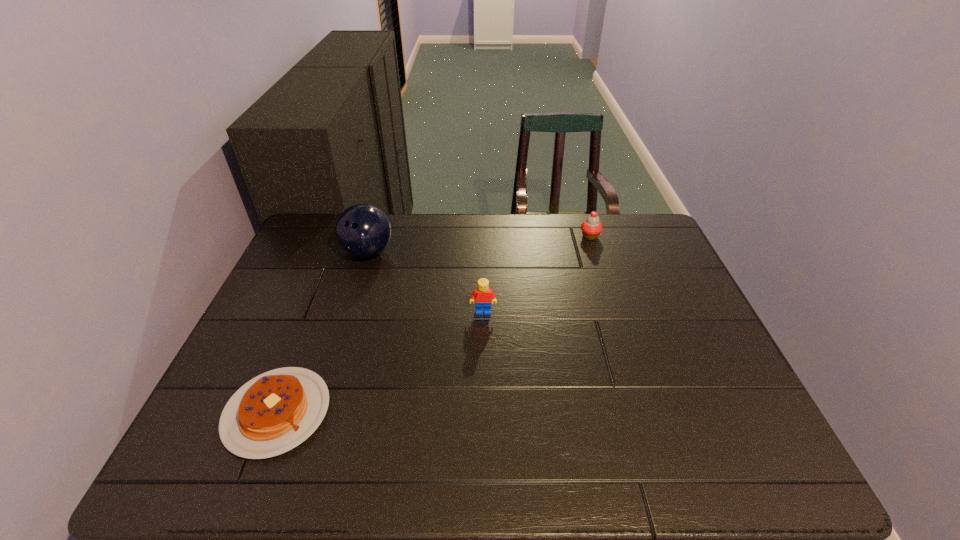
At what (x,y) coordinates should I click in order to perform the action: click on vacant space in between the third tallest object and the nearest object. Please return your answer as a coordinate pair (x, y). Looking at the image, I should click on (434, 325).

Locate an element on the screen. The height and width of the screenshot is (540, 960). unoccupied position between the second nearest object and the cupcake is located at coordinates (537, 274).

Select which object appears as the third closest to the tallest object. Please provide its 2D coordinates. Your answer should be formatted as a tuple, i.e. [(x, y)], where the tuple contains the x and y coordinates of a point satisfying the conditions above.

[(591, 228)]

You are a GUI agent. You are given a task and a screenshot of the screen. Output one action in this format:
    pyautogui.click(x=<x>, y=<y>)
    Task: Click on the object identified as the second closest to the second shortest object
    This screenshot has width=960, height=540.
    Given the screenshot: What is the action you would take?
    pyautogui.click(x=362, y=230)

The width and height of the screenshot is (960, 540). I want to click on vacant region that satisfies the following two spatial constraints: 1. on the back side of the cupcake; 2. on the right side of the nearest object, so click(346, 237).